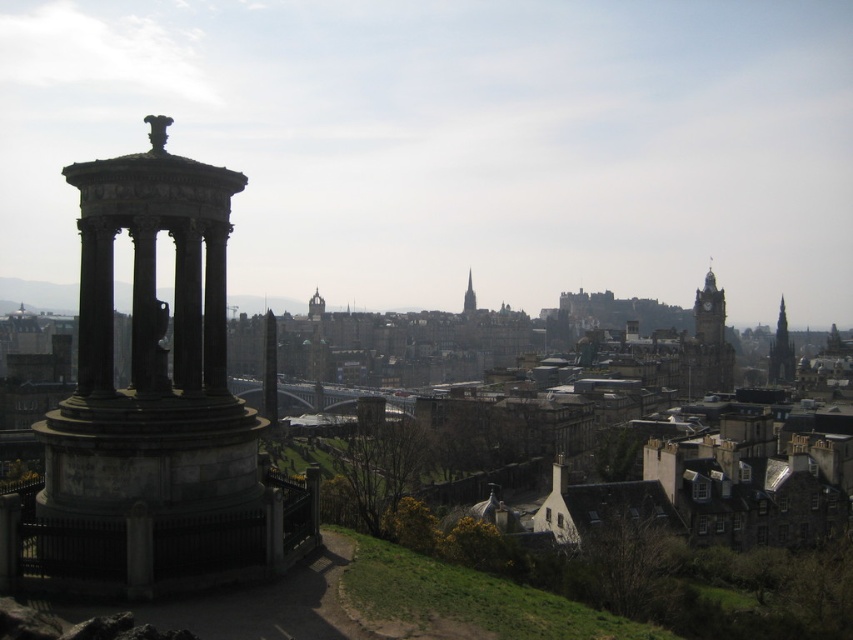
You are standing at the base of the monument and looking towards the city. Which object, the matte stone clock tower at upper right or the smooth stone tower at center, is positioned to the right of the other?

The matte stone clock tower at upper right is positioned to the right of the smooth stone tower at center.

You are an architect visiting Edinburgh and notice two smooth stone spires in the distance. Which one, the smooth stone spire at right or the smooth stone spire at center, appears bigger in the image?

The smooth stone spire at right appears bigger than the smooth stone spire at center because it is larger in size according to the description.